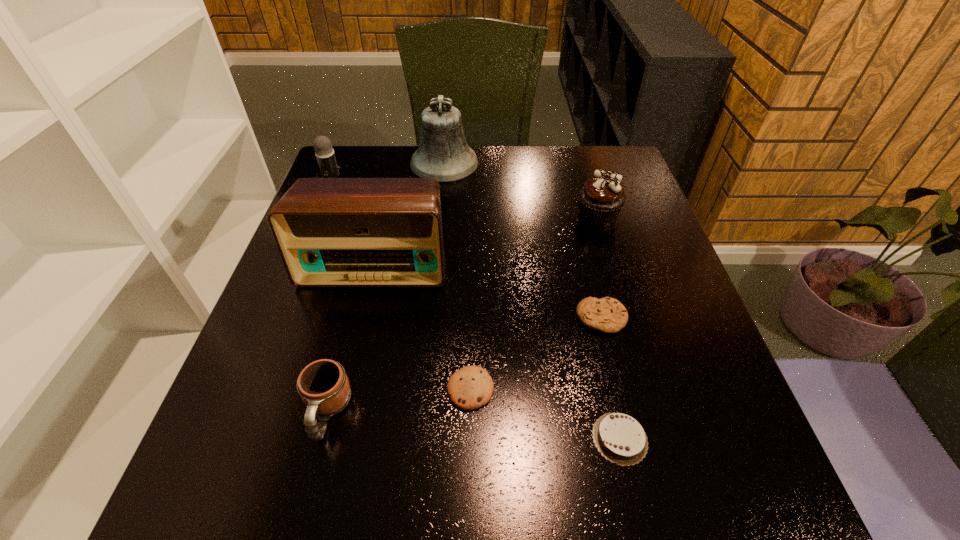
Locate an element on the screen. free space between the farther cookie and the radio receiver is located at coordinates (488, 291).

Find the location of a particular element. This screenshot has height=540, width=960. blank region between the fifth tallest object and the fourth farthest object is located at coordinates (351, 338).

Locate an element on the screen. The height and width of the screenshot is (540, 960). free area in between the mug and the chocolate cake is located at coordinates (473, 425).

The image size is (960, 540). I want to click on vacant region between the sixth nearest object and the fourth nearest object, so click(x=599, y=267).

The height and width of the screenshot is (540, 960). I want to click on object that ranks as the second closest to the chocolate cake, so click(608, 315).

Find the location of a particular element. The image size is (960, 540). object that is the sixth nearest to the fifth farthest object is located at coordinates (444, 154).

Where is `vacant region that satisfies the following two spatial constraints: 1. on the front-facing side of the left cookie; 2. on the right side of the fifth nearest object`? This screenshot has height=540, width=960. vacant region that satisfies the following two spatial constraints: 1. on the front-facing side of the left cookie; 2. on the right side of the fifth nearest object is located at coordinates (346, 389).